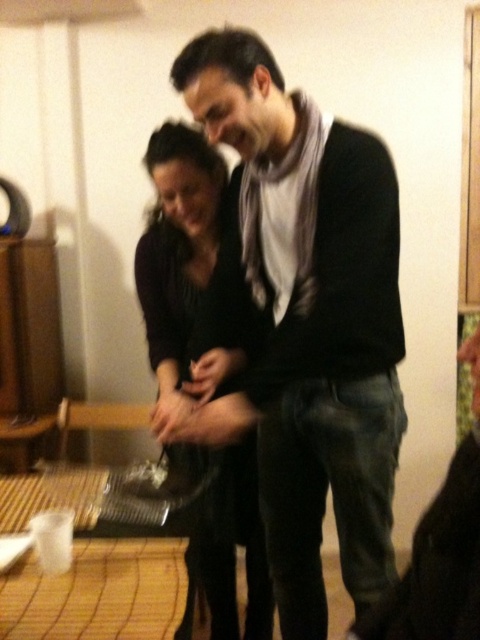
You are a photographer trying to capture a closeup of the black matte scarf at center and the black matte dress at center on the table. Since you can only focus on one object at a time, which one should you choose to ensure it appears sharp in the photo?

The black matte scarf at center is closer to the viewer than the black matte dress at center, so focusing on it will make it appear sharp while the dress may be slightly out of focus. Alternatively, focusing on the dress would leave the scarf blurry. To capture both sharply, adjust the camera settings for a deeper depth of field.

You are a tailor who needs to place a 15 inch ruler between the black matte scarf at center and the black matte dress at center on the table. Can the ruler fit between them without overlapping either item?

The black matte scarf at center and black matte dress at center are 14.94 inches apart from each other. Since the ruler is 15 inches long, it cannot fit between them without overlapping either item because the distance is slightly less than the ruler.